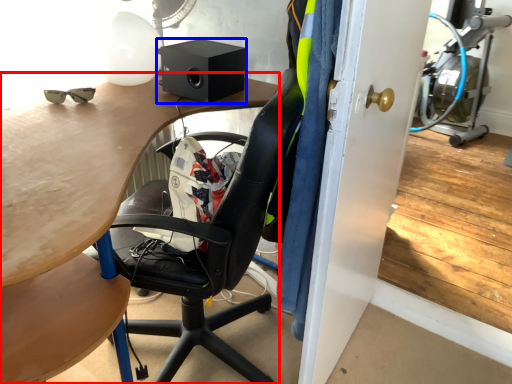
Question: Which object appears closest to the camera in this image, desk (highlighted by a red box) or loudspeaker (highlighted by a blue box)?

Choices:
 (A) desk
 (B) loudspeaker

Answer: (A)